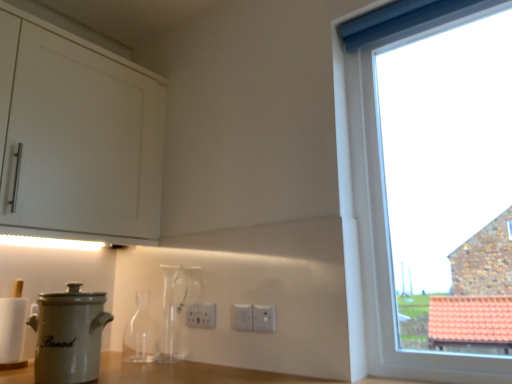
Question: Considering the positions of transparent glass bottle at center, which is the first bottle in left-to-right order, and white plastic electric outlet at center, positioned as the third electric outlet in front-to-back order, in the image, is transparent glass bottle at center, which is the first bottle in left-to-right order, taller or shorter than white plastic electric outlet at center, positioned as the third electric outlet in front-to-back order,?

Choices:
 (A) short
 (B) tall

Answer: (B)

Question: Considering the relative positions of transparent glass bottle at center, which is the first bottle in left-to-right order, and white plastic electric outlet at center, placed as the first electric outlet when sorted from left to right, in the image provided, is transparent glass bottle at center, which is the first bottle in left-to-right order, to the left or to the right of white plastic electric outlet at center, placed as the first electric outlet when sorted from left to right,?

Choices:
 (A) right
 (B) left

Answer: (B)

Question: Which is nearer to the white plastic electric outlet at center, the third electric outlet positioned from the back?

Choices:
 (A) white plastic electric outlet at center, marked as the 3th electric outlet in a right-to-left arrangement
 (B) transparent glass window at right
 (C) white plastic electric outlet at center, which is the 2th electric outlet from left to right
 (D) transparent glass bottle at center, placed as the second bottle when sorted from left to right
 (E) transparent glass bottle at center, the 2th bottle viewed from the right

Answer: (C)

Question: Estimate the real-world distances between objects in this image. Which object is farther from the transparent glass window at right?

Choices:
 (A) transparent glass bottle at center, the 1th bottle from the right
 (B) white plastic electric outlet at center, the second electric outlet positioned from the right
 (C) white plastic electric outlet at center, marked as the 1th electric outlet in a back-to-front arrangement
 (D) transparent glass bottle at center, which is the first bottle in left-to-right order
 (E) white plastic electric outlet at center, placed as the first electric outlet when sorted from front to back

Answer: (D)